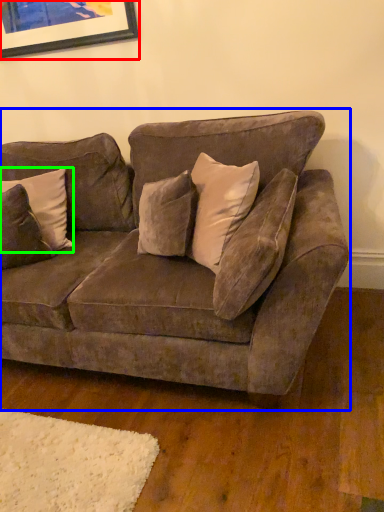
Question: Which object is positioned closest to picture frame (highlighted by a red box)? Select from studio couch (highlighted by a blue box) and pillow (highlighted by a green box).

Choices:
 (A) studio couch
 (B) pillow

Answer: (B)